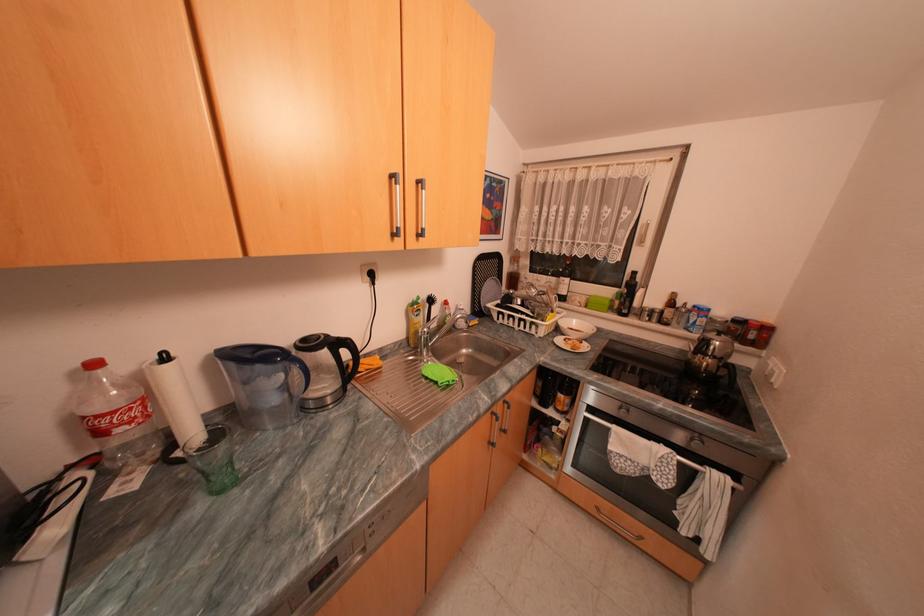
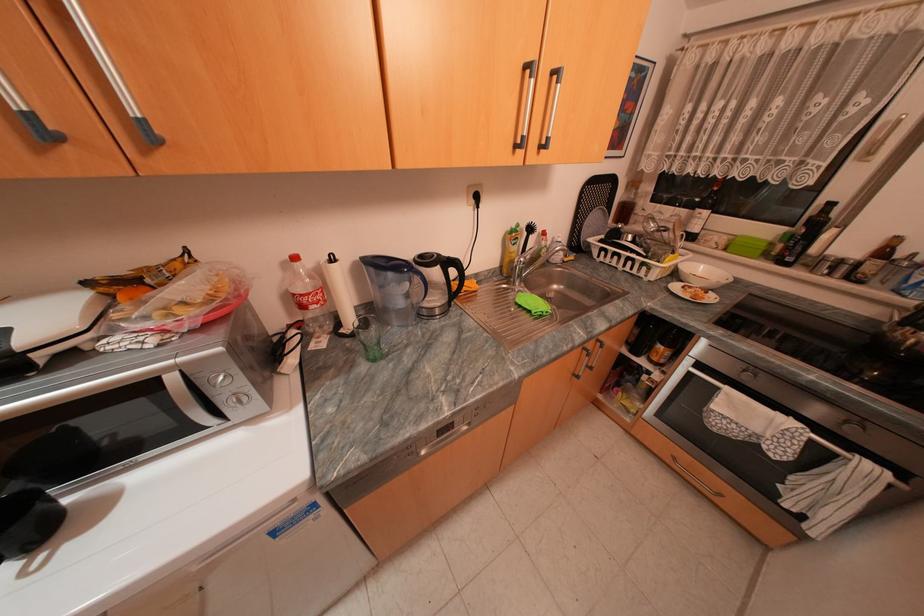
In the second image, find the point that corresponds to the point at 355,352 in the first image.

(463, 270)